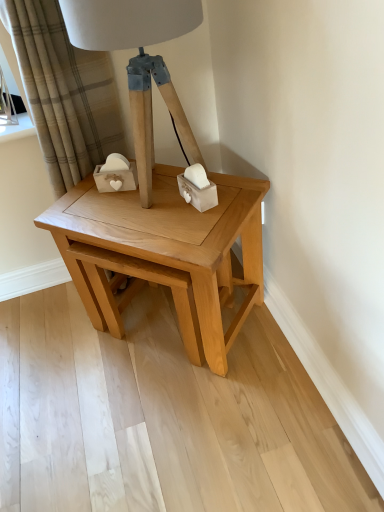
Measure the distance between point (117, 242) and camera.

The distance of point (117, 242) from camera is 3.52 feet.

At what (x,y) coordinates should I click in order to perform the action: click on beige plaid curtain at upper left. Please return your answer as a coordinate pair (x, y). Looking at the image, I should click on (65, 93).

Who is more distant, matte wood table lamp at center or beige plaid curtain at upper left?

beige plaid curtain at upper left is further away from the camera.

From the image's perspective, is matte wood table lamp at center under beige plaid curtain at upper left?

No, from the image's perspective, matte wood table lamp at center is not below beige plaid curtain at upper left.

From a real-world perspective, which is physically below, matte wood table lamp at center or beige plaid curtain at upper left?

In real-world perspective, beige plaid curtain at upper left is lower.

The height and width of the screenshot is (512, 384). In order to click on table lamp in front of the beige plaid curtain at upper left in this screenshot , I will do `click(139, 62)`.

From a real-world perspective, between beige plaid curtain at upper left and natural wood table at center, who is vertically higher?

beige plaid curtain at upper left, from a real-world perspective.

Between beige plaid curtain at upper left and natural wood table at center, which one is positioned behind?

beige plaid curtain at upper left is further from the camera.

Can you confirm if beige plaid curtain at upper left is smaller than natural wood table at center?

Correct, beige plaid curtain at upper left occupies less space than natural wood table at center.

Does beige plaid curtain at upper left touch natural wood table at center?

No, beige plaid curtain at upper left is not making contact with natural wood table at center.

Considering the sizes of objects natural wood table at center and beige plaid curtain at upper left in the image provided, who is taller, natural wood table at center or beige plaid curtain at upper left?

Standing taller between the two is beige plaid curtain at upper left.

Which point is more forward, (x=125, y=273) or (x=87, y=115)?

The point (x=125, y=273) is closer to the camera.

How many degrees apart are the facing directions of natural wood table at center and beige plaid curtain at upper left?

The angular difference between natural wood table at center and beige plaid curtain at upper left is 46.1 degrees.

Consider the image. Could you tell me if natural wood table at center is facing beige plaid curtain at upper left?

No, natural wood table at center is not facing towards beige plaid curtain at upper left.

Is the surface of natural wood table at center in direct contact with matte wood table lamp at center?

No, natural wood table at center is not beside matte wood table lamp at center.

In the scene shown: Is natural wood table at center positioned with its back to matte wood table lamp at center?

natural wood table at center is not turned away from matte wood table lamp at center.

Identify the location of table lamp that is above the natural wood table at center (from the image's perspective). The width and height of the screenshot is (384, 512). (139, 62).

Considering the relative positions of natural wood table at center and matte wood table lamp at center in the image provided, is natural wood table at center to the left or to the right of matte wood table lamp at center?

Clearly, natural wood table at center is on the right of matte wood table lamp at center in the image.

Is matte wood table lamp at center inside beige plaid curtain at upper left?

No.

Based on the photo, from a real-world perspective, which is physically above, beige plaid curtain at upper left or matte wood table lamp at center?

From a 3D spatial view, matte wood table lamp at center is above.

Is beige plaid curtain at upper left positioned with its back to matte wood table lamp at center?

No.

Is beige plaid curtain at upper left bigger or smaller than matte wood table lamp at center?

Clearly, beige plaid curtain at upper left is larger in size than matte wood table lamp at center.

Is matte wood table lamp at center positioned behind natural wood table at center?

No, the depth of matte wood table lamp at center is less than that of natural wood table at center.

From a real-world perspective, between matte wood table lamp at center and natural wood table at center, who is vertically higher?

matte wood table lamp at center is physically above.

In the scene shown: Are matte wood table lamp at center and natural wood table at center beside each other?

No, matte wood table lamp at center is not making contact with natural wood table at center.

Is matte wood table lamp at center facing away from natural wood table at center?

That's not correct — matte wood table lamp at center is not looking away from natural wood table at center.

This screenshot has width=384, height=512. I want to click on curtain on the left of matte wood table lamp at center, so click(x=65, y=93).

The height and width of the screenshot is (512, 384). What are the coordinates of `table below the beige plaid curtain at upper left (from a real-world perspective)` in the screenshot? It's located at (164, 255).

When comparing their distances from beige plaid curtain at upper left, does natural wood table at center or matte wood table lamp at center seem further?

natural wood table at center.

Which object lies further to the anchor point beige plaid curtain at upper left, matte wood table lamp at center or natural wood table at center?

Based on the image, natural wood table at center appears to be further to beige plaid curtain at upper left.

Which object lies further to the anchor point natural wood table at center, matte wood table lamp at center or beige plaid curtain at upper left?

The object further to natural wood table at center is beige plaid curtain at upper left.

Looking at the image, which one is located closer to natural wood table at center, beige plaid curtain at upper left or matte wood table lamp at center?

matte wood table lamp at center lies closer to natural wood table at center than the other object.

Considering their positions, is beige plaid curtain at upper left positioned closer to matte wood table lamp at center than natural wood table at center?

Among the two, natural wood table at center is located nearer to matte wood table lamp at center.

Which object lies further to the anchor point matte wood table lamp at center, natural wood table at center or beige plaid curtain at upper left?

Based on the image, beige plaid curtain at upper left appears to be further to matte wood table lamp at center.

Locate an element on the screen. curtain that lies between matte wood table lamp at center and natural wood table at center from top to bottom is located at coordinates (65, 93).